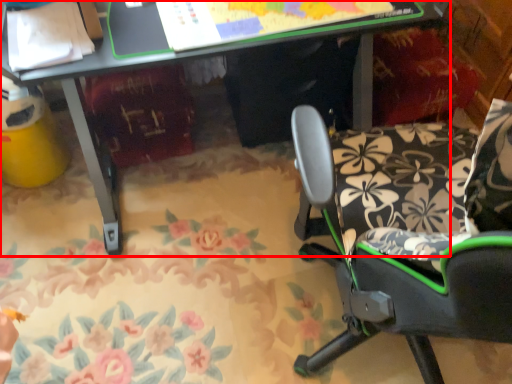
Question: Observing the image, what is the correct spatial positioning of desk (annotated by the red box) in reference to chair?

Choices:
 (A) left
 (B) right

Answer: (A)